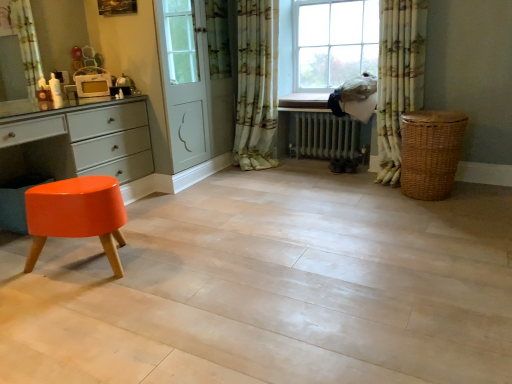
Question: Is glossy orange stool at lower left oriented away from white glossy microwave at upper left?

Choices:
 (A) no
 (B) yes

Answer: (A)

Question: From the image's perspective, is glossy orange stool at lower left beneath white glossy microwave at upper left?

Choices:
 (A) yes
 (B) no

Answer: (A)

Question: Does glossy orange stool at lower left have a lesser height compared to white glossy microwave at upper left?

Choices:
 (A) yes
 (B) no

Answer: (B)

Question: Is glossy orange stool at lower left to the right of white glossy microwave at upper left from the viewer's perspective?

Choices:
 (A) yes
 (B) no

Answer: (B)

Question: Considering the relative sizes of glossy orange stool at lower left and white glossy microwave at upper left in the image provided, is glossy orange stool at lower left taller than white glossy microwave at upper left?

Choices:
 (A) yes
 (B) no

Answer: (A)

Question: Considering their positions, is white metallic radiator at center located in front of or behind glossy orange stool at lower left?

Choices:
 (A) behind
 (B) front

Answer: (A)

Question: From the image's perspective, relative to glossy orange stool at lower left, is white metallic radiator at center above or below?

Choices:
 (A) below
 (B) above

Answer: (B)

Question: Which is correct: white metallic radiator at center is inside glossy orange stool at lower left, or outside of it?

Choices:
 (A) inside
 (B) outside

Answer: (B)

Question: Does point (315, 132) appear closer or farther from the camera than point (25, 130)?

Choices:
 (A) farther
 (B) closer

Answer: (A)

Question: From their relative heights in the image, would you say woven brown basket at right is taller or shorter than glossy orange stool at lower left?

Choices:
 (A) tall
 (B) short

Answer: (B)

Question: Choose the correct answer: Is woven brown basket at right inside glossy orange stool at lower left or outside it?

Choices:
 (A) outside
 (B) inside

Answer: (A)

Question: Visually, is woven brown basket at right positioned to the left or to the right of glossy orange stool at lower left?

Choices:
 (A) right
 (B) left

Answer: (A)

Question: Does point (441, 140) appear closer or farther from the camera than point (135, 137)?

Choices:
 (A) farther
 (B) closer

Answer: (B)

Question: From the image's perspective, is orange glossy stool at lower left located above or below woven brown basket at right?

Choices:
 (A) above
 (B) below

Answer: (B)

Question: Is orange glossy stool at lower left wider or thinner than woven brown basket at right?

Choices:
 (A) wide
 (B) thin

Answer: (B)